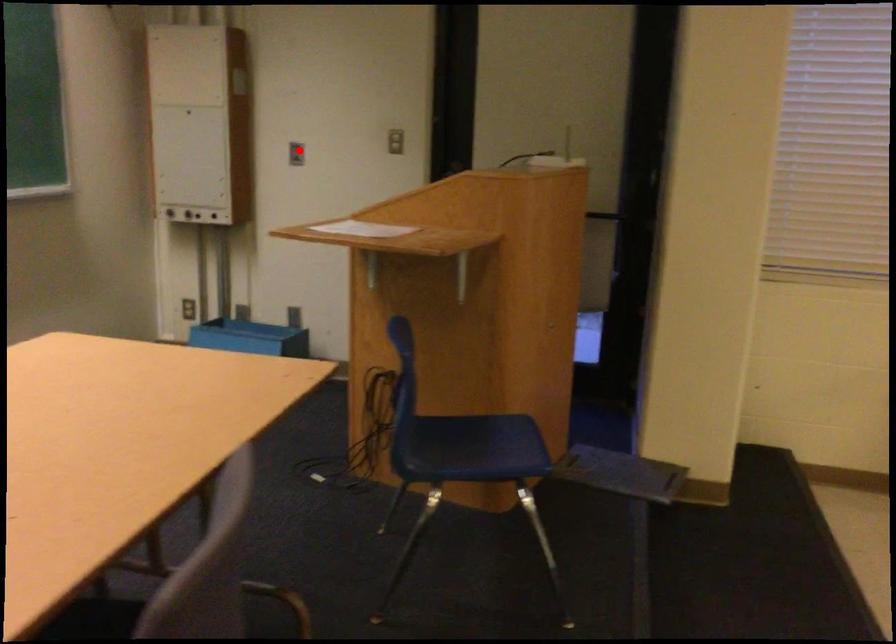
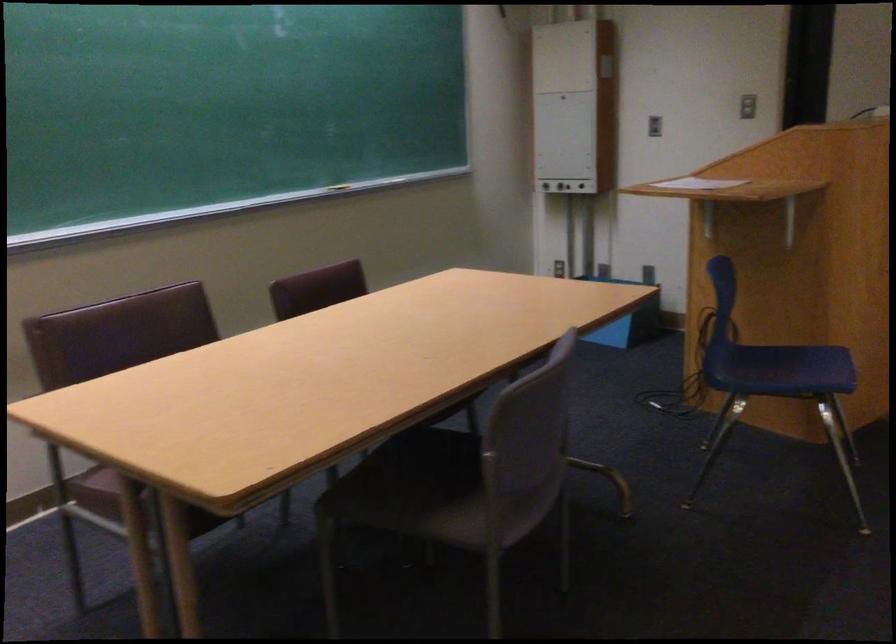
Locate, in the second image, the point that corresponds to the highlighted location in the first image.

(653, 126)